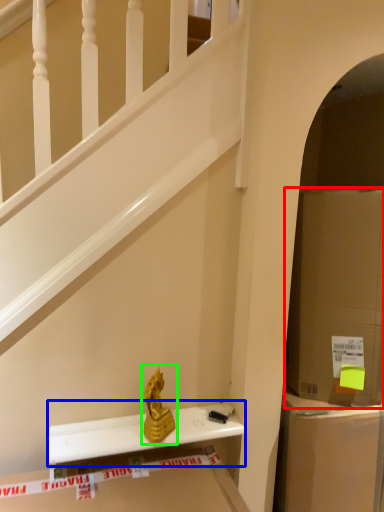
Question: Considering the real-world distances, which object is closest to cardboard box (highlighted by a red box)? window sill (highlighted by a blue box) or sculpture (highlighted by a green box).

Choices:
 (A) window sill
 (B) sculpture

Answer: (A)